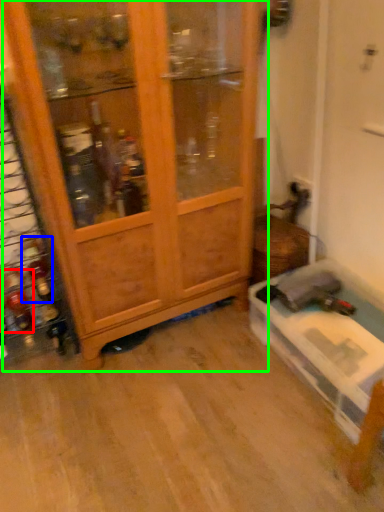
Question: Which object is the closest to the bottle (highlighted by a red box)? Choose among these: bottle (highlighted by a blue box) or cupboard (highlighted by a green box).

Choices:
 (A) bottle
 (B) cupboard

Answer: (A)